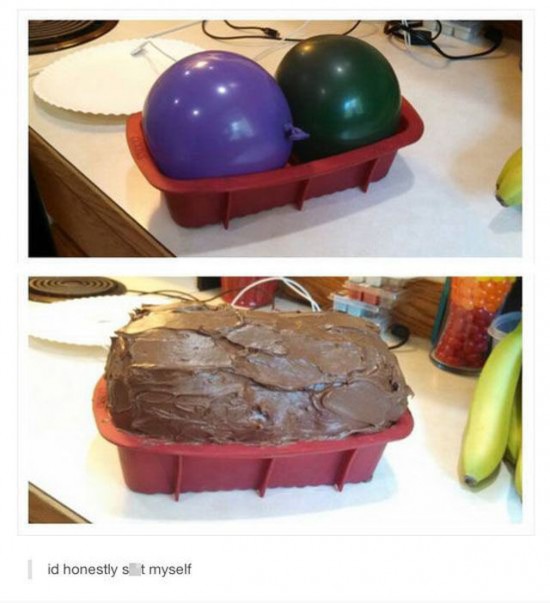
The height and width of the screenshot is (603, 550). I want to click on plate, so [98, 80].